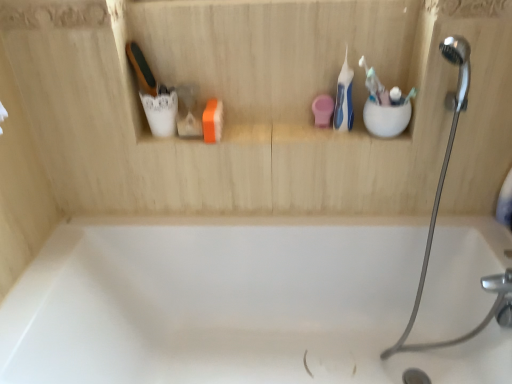
Question: From a real-world perspective, is silver metallic shower head at upper right on top of white plastic toothbrush at upper right, which is counted as the second toothbrush, starting from the left?

Choices:
 (A) yes
 (B) no

Answer: (B)

Question: Considering the relative positions of silver metallic shower head at upper right and white plastic toothbrush at upper right, which is counted as the second toothbrush, starting from the left, in the image provided, is silver metallic shower head at upper right to the left of white plastic toothbrush at upper right, which is counted as the second toothbrush, starting from the left, from the viewer's perspective?

Choices:
 (A) no
 (B) yes

Answer: (A)

Question: Can you confirm if silver metallic shower head at upper right is shorter than white plastic toothbrush at upper right, which is counted as the second toothbrush, starting from the left?

Choices:
 (A) no
 (B) yes

Answer: (A)

Question: Is the surface of silver metallic shower head at upper right in direct contact with white plastic toothbrush at upper right, the second toothbrush when ordered from right to left?

Choices:
 (A) no
 (B) yes

Answer: (A)

Question: Is silver metallic shower head at upper right wider than white plastic toothbrush at upper right, the second toothbrush when ordered from right to left?

Choices:
 (A) no
 (B) yes

Answer: (B)

Question: Is white plastic toothbrush at upper right, the third toothbrush in the left-to-right sequence, bigger or smaller than blue plastic toothbrush at upper right, the 1th toothbrush from the left?

Choices:
 (A) small
 (B) big

Answer: (A)

Question: In the image, is white plastic toothbrush at upper right, the third toothbrush in the left-to-right sequence, on the left side or the right side of blue plastic toothbrush at upper right, arranged as the 3th toothbrush when viewed from the right?

Choices:
 (A) right
 (B) left

Answer: (A)

Question: Considering the positions of point (407, 97) and point (338, 74), is point (407, 97) closer or farther from the camera than point (338, 74)?

Choices:
 (A) closer
 (B) farther

Answer: (A)

Question: From a real-world perspective, is white plastic toothbrush at upper right, which is counted as the 1th toothbrush, starting from the right, positioned above or below blue plastic toothbrush at upper right, arranged as the 3th toothbrush when viewed from the right?

Choices:
 (A) above
 (B) below

Answer: (A)

Question: From a real-world perspective, is silver metallic shower head at upper right positioned above or below white plastic toothbrush at upper right, which is counted as the second toothbrush, starting from the left?

Choices:
 (A) above
 (B) below

Answer: (B)

Question: From the image's perspective, is silver metallic shower head at upper right located above or below white plastic toothbrush at upper right, the second toothbrush when ordered from right to left?

Choices:
 (A) below
 (B) above

Answer: (A)

Question: Is silver metallic shower head at upper right situated inside white plastic toothbrush at upper right, the second toothbrush when ordered from right to left, or outside?

Choices:
 (A) inside
 (B) outside

Answer: (B)

Question: Looking at the image, does silver metallic shower head at upper right seem bigger or smaller compared to white plastic toothbrush at upper right, which is counted as the second toothbrush, starting from the left?

Choices:
 (A) small
 (B) big

Answer: (B)

Question: Is white plastic toothbrush at upper right, which is counted as the second toothbrush, starting from the left, taller or shorter than blue plastic toothbrush at upper right, the 1th toothbrush from the left?

Choices:
 (A) tall
 (B) short

Answer: (B)

Question: Based on their positions, is white plastic toothbrush at upper right, the second toothbrush when ordered from right to left, located to the left or right of blue plastic toothbrush at upper right, the 1th toothbrush from the left?

Choices:
 (A) left
 (B) right

Answer: (B)